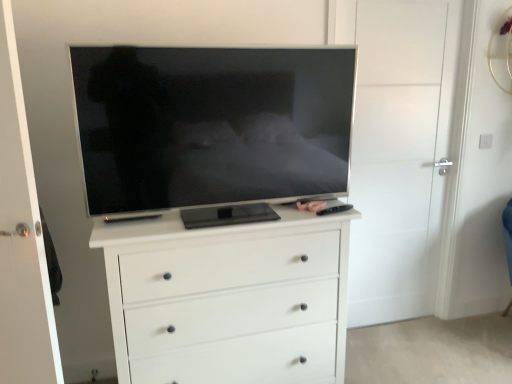
Question: Should I look upward or downward to see black plastic remote at right?

Choices:
 (A) up
 (B) down

Answer: (B)

Question: From a real-world perspective, is white matte door at center, which is counted as the second door, starting from the right, on top of white matte door at center, the second door viewed from the front?

Choices:
 (A) no
 (B) yes

Answer: (A)

Question: Considering the relative sizes of white matte door at center, which is counted as the second door, starting from the right, and white matte door at center, the second door viewed from the front, in the image provided, is white matte door at center, which is counted as the second door, starting from the right, shorter than white matte door at center, the second door viewed from the front,?

Choices:
 (A) yes
 (B) no

Answer: (A)

Question: Is white matte door at center, the first door when ordered from left to right, positioned far away from white matte door at center, the second door viewed from the front?

Choices:
 (A) no
 (B) yes

Answer: (B)

Question: Can we say white matte door at center, placed as the 2th door when sorted from back to front, lies outside white matte door at center, the 1th door when ordered from right to left?

Choices:
 (A) yes
 (B) no

Answer: (A)

Question: Is the depth of white matte door at center, which is counted as the second door, starting from the right, greater than that of white matte door at center, the second door viewed from the front?

Choices:
 (A) yes
 (B) no

Answer: (B)

Question: Is white matte door at center, the first door when ordered from left to right, wider than white matte door at center, positioned as the 1th door in back-to-front order?

Choices:
 (A) yes
 (B) no

Answer: (A)

Question: Is matte black remote control at center shorter than black plastic remote at right?

Choices:
 (A) no
 (B) yes

Answer: (A)

Question: Does matte black remote control at center appear on the right side of black plastic remote at right?

Choices:
 (A) no
 (B) yes

Answer: (A)

Question: From the image's perspective, is matte black remote control at center over black plastic remote at right?

Choices:
 (A) no
 (B) yes

Answer: (B)

Question: Is matte black remote control at center in front of black plastic remote at right?

Choices:
 (A) yes
 (B) no

Answer: (B)

Question: Does matte black remote control at center contain black plastic remote at right?

Choices:
 (A) yes
 (B) no

Answer: (B)

Question: Considering the relative positions of matte black remote control at center and black plastic remote at right in the image provided, is matte black remote control at center to the left of black plastic remote at right from the viewer's perspective?

Choices:
 (A) no
 (B) yes

Answer: (B)

Question: Does white matte door at center, the 2th door from the left, have a greater height compared to matte black remote control at center?

Choices:
 (A) yes
 (B) no

Answer: (A)